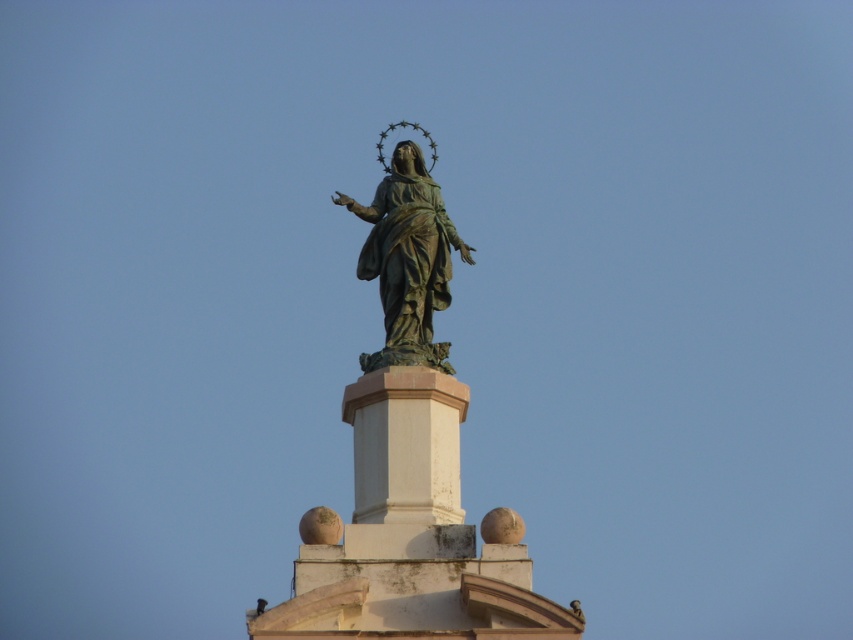
Between white stone pedestal at center and bronze statue at center, which one appears on the left side from the viewer's perspective?

white stone pedestal at center

Who is more forward, [354,508] or [421,275]?

Point [421,275]

Who is more forward, (374, 433) or (445, 266)?

Point (374, 433)

Locate an element on the screen. This screenshot has width=853, height=640. white stone pedestal at center is located at coordinates [x=405, y=444].